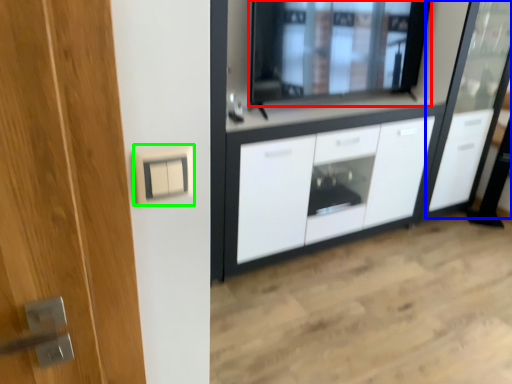
Question: Estimate the real-world distances between objects in this image. Which object is farther from window (highlighted by a red box), screen door (highlighted by a blue box) or electric outlet (highlighted by a green box)?

Choices:
 (A) screen door
 (B) electric outlet

Answer: (B)